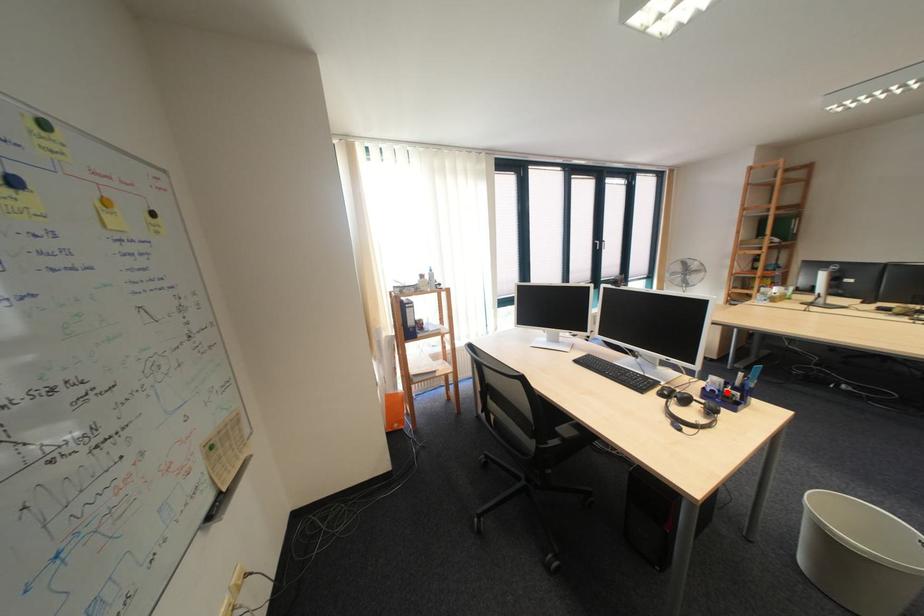
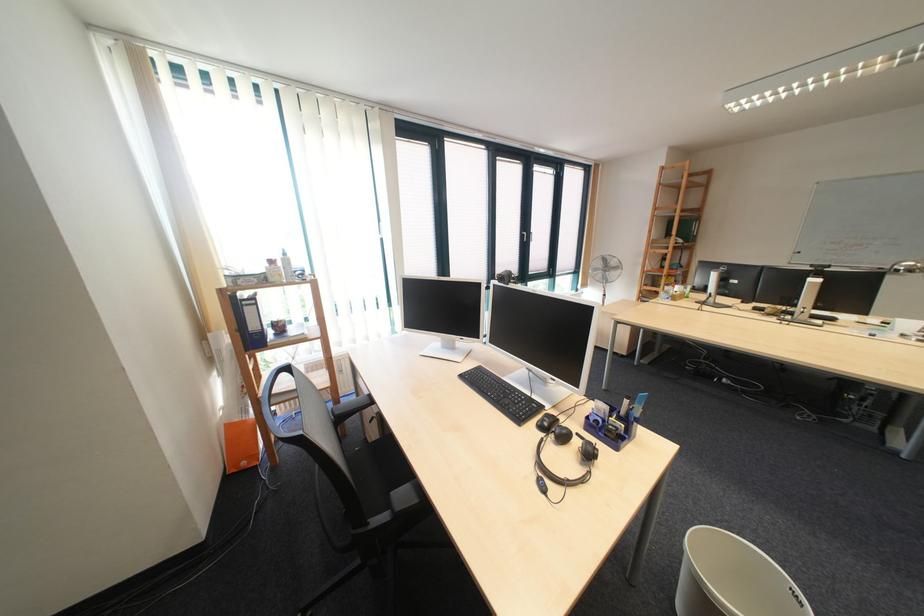
Find the pixel in the second image that matches the highlighted location in the first image.

(611, 423)